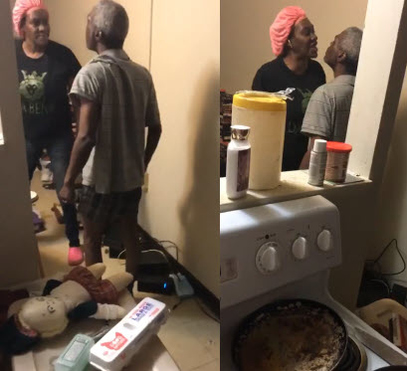
You are a GUI agent. You are given a task and a screenshot of the screen. Output one action in this format:
    pyautogui.click(x=<x>, y=<y>)
    Task: Click on the shower caps
    
    Given the screenshot: What is the action you would take?
    pyautogui.click(x=28, y=6), pyautogui.click(x=283, y=17)